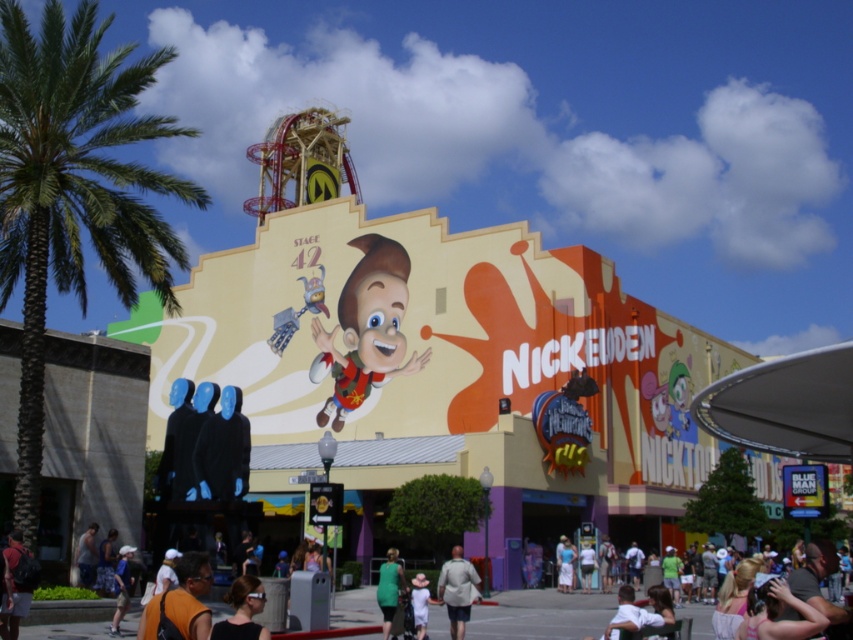
Question: Does dark blue jeans at lower left have a greater width compared to white fabric shirt at lower center?

Choices:
 (A) yes
 (B) no

Answer: (B)

Question: Is green leafy palm tree at left positioned behind dark blue jeans at lower left?

Choices:
 (A) yes
 (B) no

Answer: (B)

Question: Can you confirm if black matte jacket at center is smaller than white fabric shirt at lower center?

Choices:
 (A) no
 (B) yes

Answer: (B)

Question: Which object is the farthest from the light beige jacket at center?

Choices:
 (A) green matte dress at lower center
 (B) light brown hair at center
 (C) white cotton dress at center
 (D) green leafy palm tree at left

Answer: (D)

Question: Which of the following is the farthest from the observer?

Choices:
 (A) green matte dress at lower center
 (B) white fabric shirt at lower center

Answer: (B)

Question: Which point appears farthest from the camera in this image?

Choices:
 (A) (413, 579)
 (B) (206, 493)
 (C) (383, 252)
 (D) (16, 609)

Answer: (C)